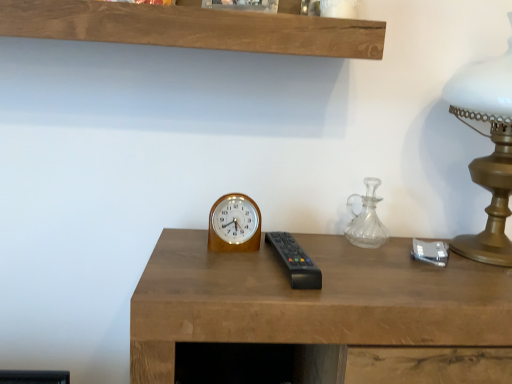
Question: From the image's perspective, is clear glass carafe at right located above black plastic remote at center?

Choices:
 (A) yes
 (B) no

Answer: (A)

Question: Would you say clear glass carafe at right contains black plastic remote at center?

Choices:
 (A) no
 (B) yes

Answer: (A)

Question: Is clear glass carafe at right at the left side of black plastic remote at center?

Choices:
 (A) no
 (B) yes

Answer: (A)

Question: From a real-world perspective, is clear glass carafe at right positioned under black plastic remote at center based on gravity?

Choices:
 (A) no
 (B) yes

Answer: (A)

Question: From a real-world perspective, is clear glass carafe at right physically above black plastic remote at center?

Choices:
 (A) no
 (B) yes

Answer: (B)

Question: Considering the positions of black plastic remote at center and wooden desk at center in the image, is black plastic remote at center bigger or smaller than wooden desk at center?

Choices:
 (A) small
 (B) big

Answer: (A)

Question: From a real-world perspective, is black plastic remote at center physically located above or below wooden desk at center?

Choices:
 (A) above
 (B) below

Answer: (A)

Question: In terms of height, does black plastic remote at center look taller or shorter compared to wooden desk at center?

Choices:
 (A) tall
 (B) short

Answer: (B)

Question: Is black plastic remote at center in front of or behind wooden desk at center in the image?

Choices:
 (A) behind
 (B) front

Answer: (A)

Question: From the image's perspective, is gold metallic table lamp at right above or below black plastic remote at center?

Choices:
 (A) above
 (B) below

Answer: (A)

Question: From a real-world perspective, is gold metallic table lamp at right positioned above or below black plastic remote at center?

Choices:
 (A) above
 (B) below

Answer: (A)

Question: Considering the positions of point (490, 81) and point (310, 281), is point (490, 81) closer or farther from the camera than point (310, 281)?

Choices:
 (A) farther
 (B) closer

Answer: (A)

Question: Choose the correct answer: Is gold metallic table lamp at right inside black plastic remote at center or outside it?

Choices:
 (A) outside
 (B) inside

Answer: (A)

Question: Is wooden wall clock at center in front of or behind gold metallic table lamp at right in the image?

Choices:
 (A) front
 (B) behind

Answer: (B)

Question: Is wooden wall clock at center to the left or to the right of gold metallic table lamp at right in the image?

Choices:
 (A) left
 (B) right

Answer: (A)